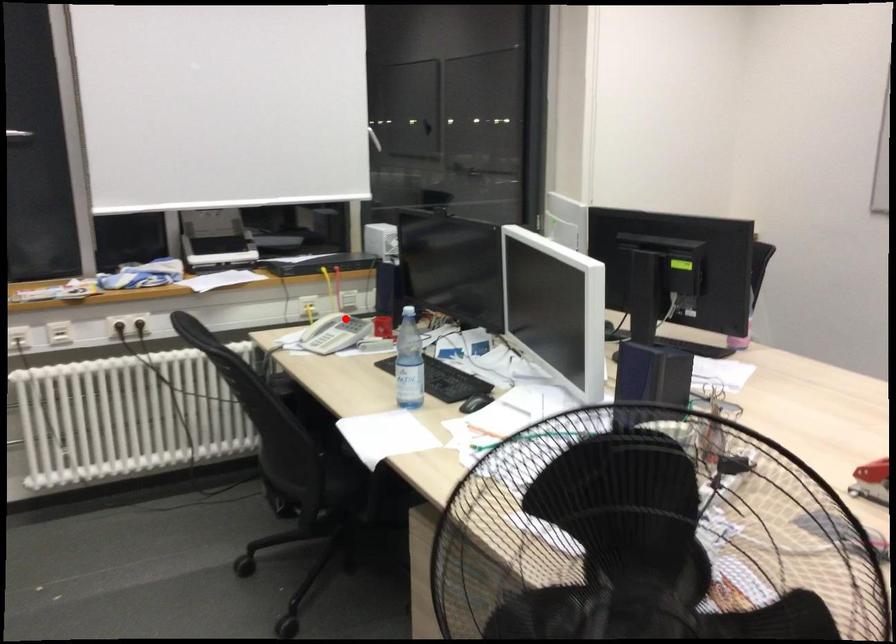
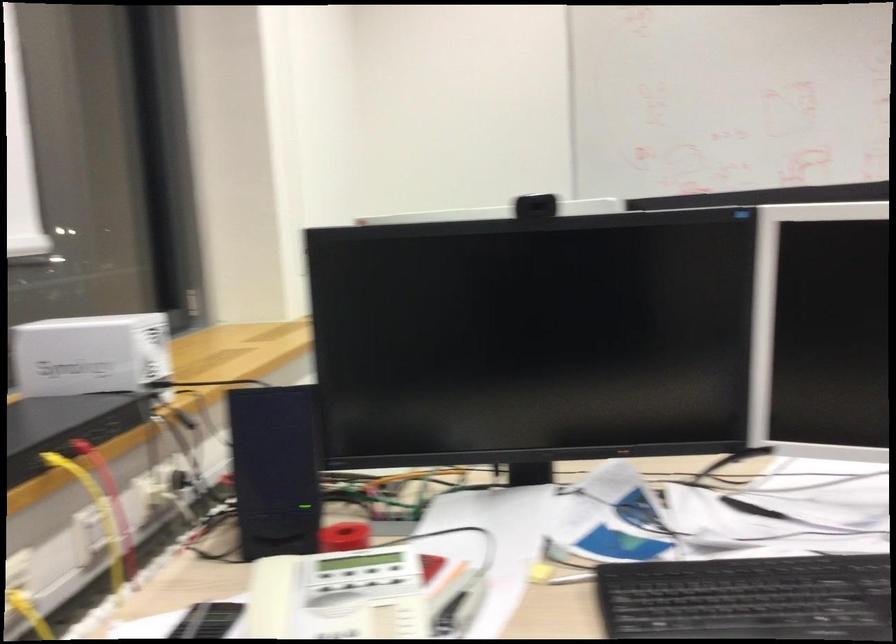
Question: I am providing you with two images of the same scene from different viewpoints. In image1, a red point is highlighted. Considering the same 3D point in image2, which of the following is correct?

Choices:
 (A) It is closer
 (B) It is farther

Answer: (A)